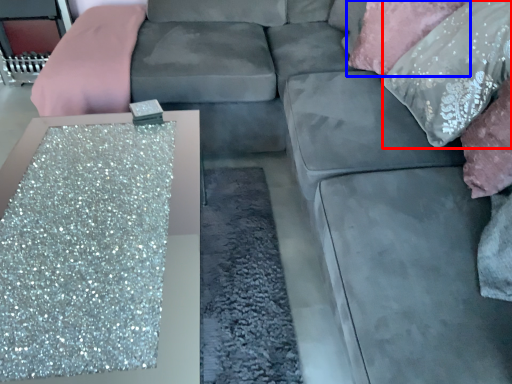
Question: Which point is further to the camera, pillow (highlighted by a red box) or pillow (highlighted by a blue box)?

Choices:
 (A) pillow
 (B) pillow

Answer: (B)